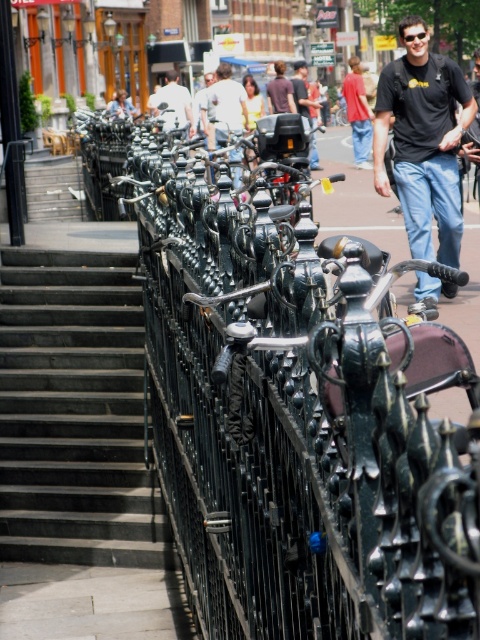
Does white matte shirt at upper center have a larger size compared to dark blue jeans at center?

Yes.

Is point (153, 106) closer to viewer compared to point (310, 164)?

No, it is behind (310, 164).

Where is `white matte shirt at upper center`? The height and width of the screenshot is (640, 480). white matte shirt at upper center is located at coordinates (172, 104).

Does black wrought iron fence at left have a larger size compared to white matte shirt at upper center?

No.

Is black wrought iron fence at left positioned before white matte shirt at upper center?

Yes, it is.

You are a GUI agent. You are given a task and a screenshot of the screen. Output one action in this format:
    pyautogui.click(x=<x>, y=<y>)
    Task: Click on the black wrought iron fence at left
    This screenshot has width=480, height=640.
    Given the screenshot: What is the action you would take?
    pyautogui.click(x=295, y=412)

Can you confirm if dark gray concrete stairs at lower left is bigger than white shirt at center?

Incorrect, dark gray concrete stairs at lower left is not larger than white shirt at center.

Is dark gray concrete stairs at lower left closer to camera compared to white shirt at center?

Yes, it is.

This screenshot has height=640, width=480. Find the location of `dark gray concrete stairs at lower left`. dark gray concrete stairs at lower left is located at coordinates (74, 413).